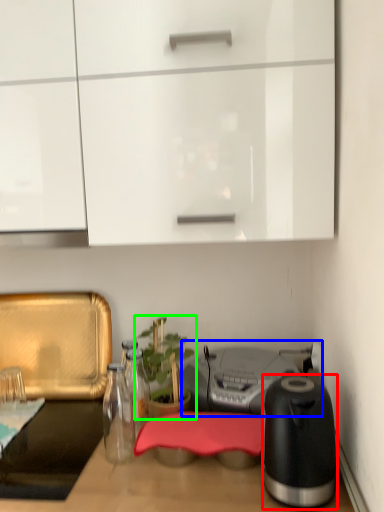
Question: Estimate the real-world distances between objects in this image. Which object is farther from kitchen appliance (highlighted by a red box), appliance (highlighted by a blue box) or houseplant (highlighted by a green box)?

Choices:
 (A) appliance
 (B) houseplant

Answer: (B)